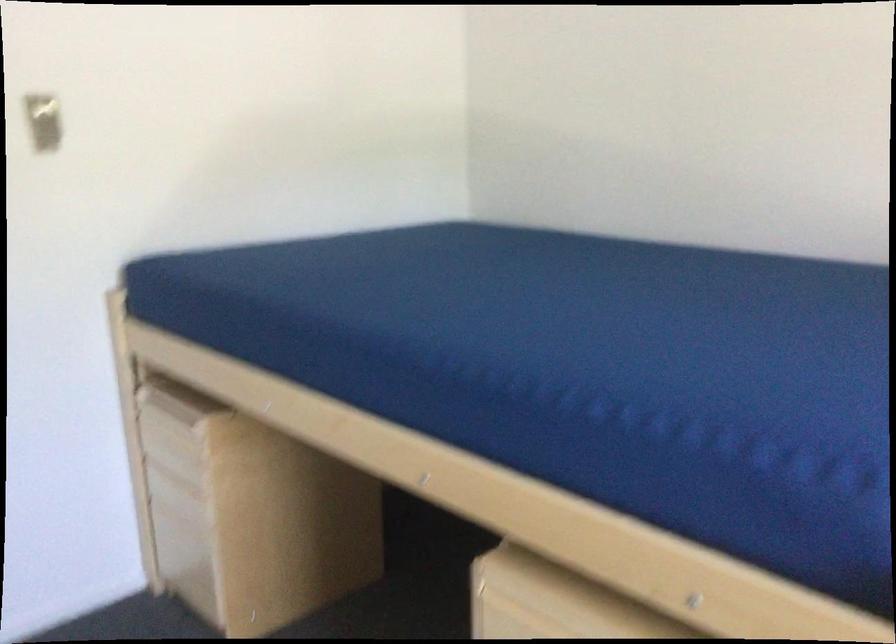
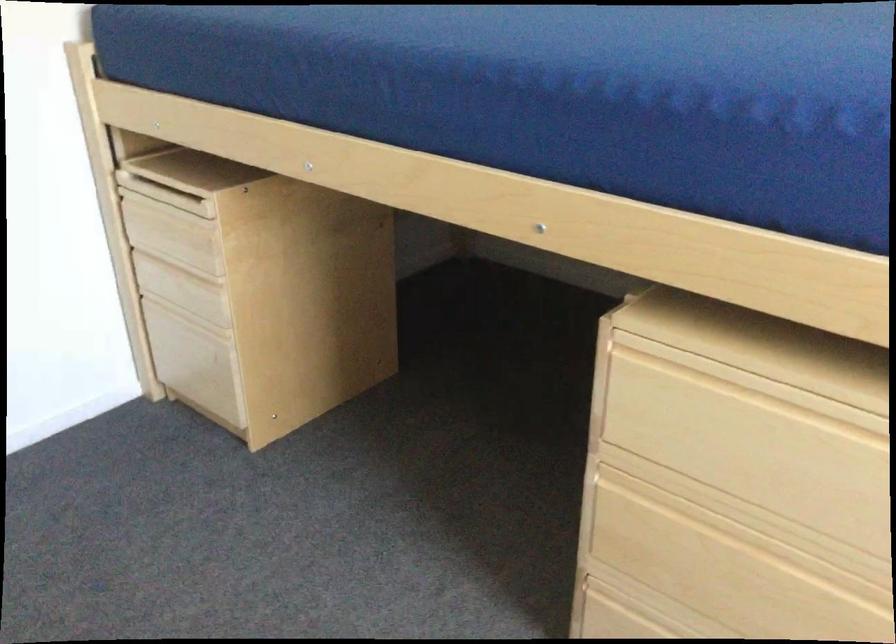
Which direction would the cameraman need to move to produce the second image?

The cameraman moved toward left, forward.